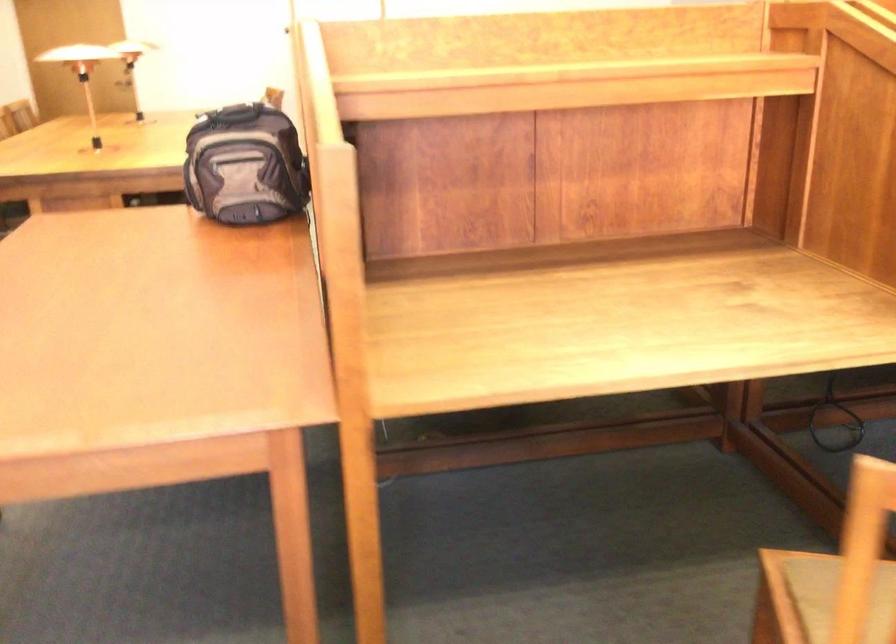
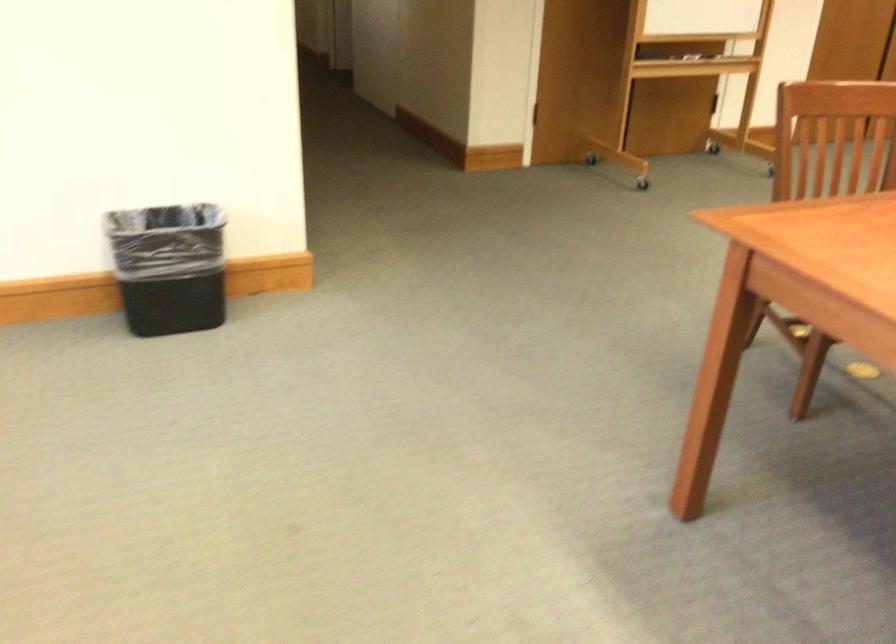
First-person continuous shooting, in which direction is the camera rotating?

The camera rotated toward left-down.